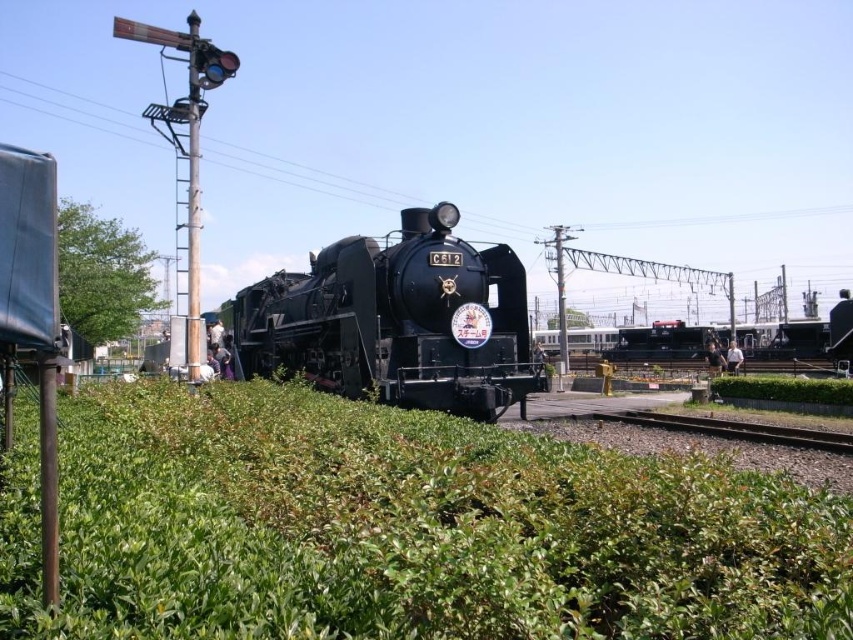
Question: Does green leafy hedge at center appear over brown gravel train track at lower center?

Choices:
 (A) yes
 (B) no

Answer: (A)

Question: Is green leafy hedge at center behind green leafy bush at left?

Choices:
 (A) yes
 (B) no

Answer: (A)

Question: Can you confirm if green leafy hedge at center is bigger than brown gravel train track at lower center?

Choices:
 (A) yes
 (B) no

Answer: (B)

Question: Which object is farther from the camera taking this photo?

Choices:
 (A) polished metal train at center
 (B) black polished steam engine at center
 (C) green leafy bush at left
 (D) brown gravel train track at lower center

Answer: (A)

Question: Which of these objects is positioned closest to the green leafy bush at left?

Choices:
 (A) polished metal train at center
 (B) green leafy hedge at center
 (C) black polished steam engine at center
 (D) brown gravel train track at lower center

Answer: (C)

Question: Which of these objects is positioned closest to the black polished steam engine at center?

Choices:
 (A) polished metal train at center
 (B) green leafy bush at left
 (C) brown gravel train track at lower center
 (D) green leafy hedge at center

Answer: (C)